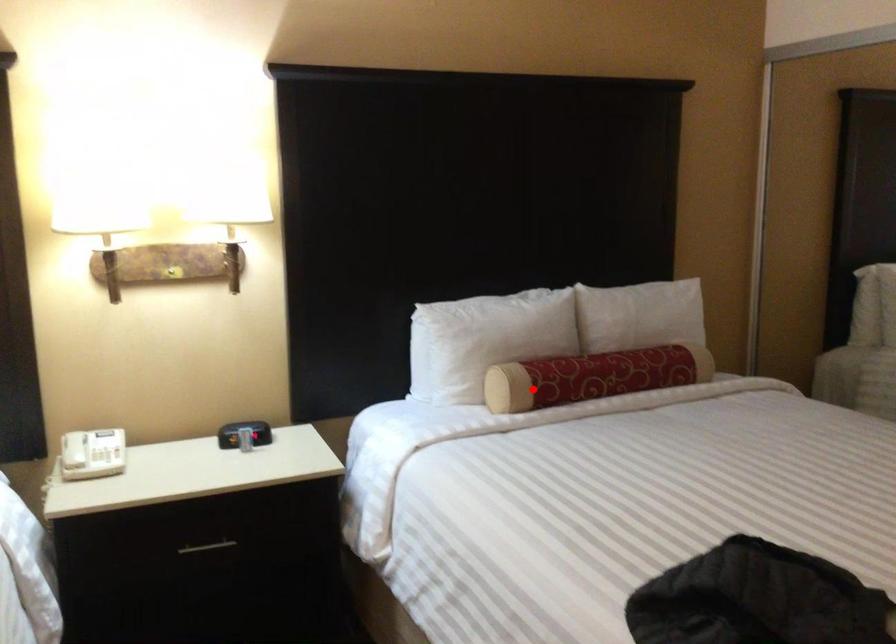
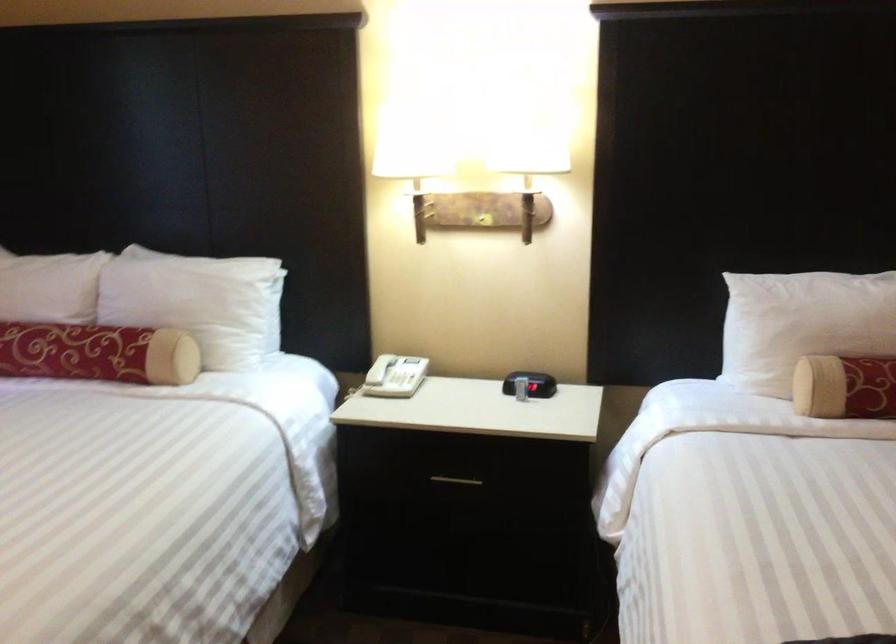
Question: I am providing you with two images of the same scene from different viewpoints. In image1, a red point is highlighted. Considering the same 3D point in image2, which of the following is correct?

Choices:
 (A) It is closer
 (B) It is farther

Answer: (A)